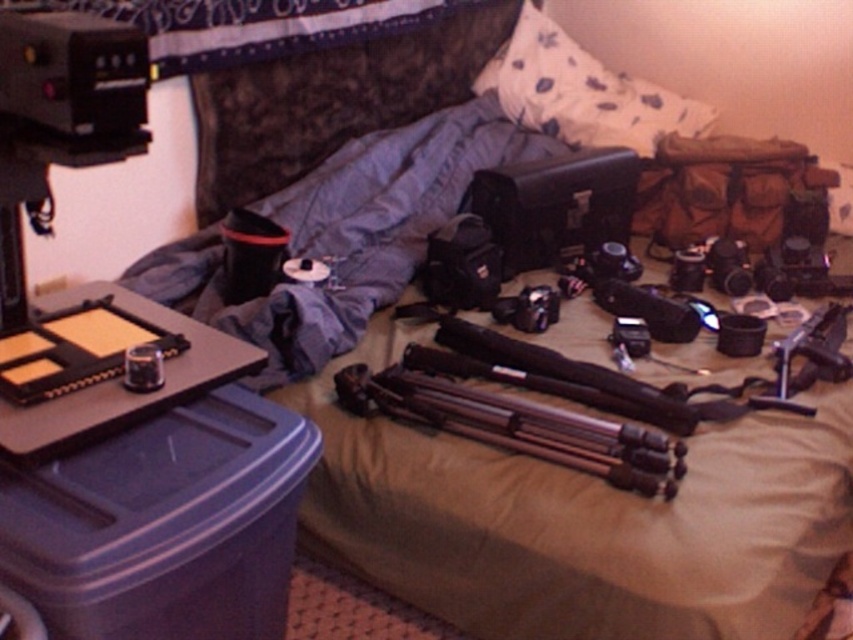
Question: Can you confirm if silver metallic tripod at center is smaller than white floral fabric pillow at upper center?

Choices:
 (A) no
 (B) yes

Answer: (B)

Question: Can you confirm if silver metallic tripod at center is positioned above white floral fabric pillow at upper center?

Choices:
 (A) yes
 (B) no

Answer: (B)

Question: Which point appears closest to the camera in this image?

Choices:
 (A) (596, 88)
 (B) (604, 451)

Answer: (B)

Question: Which of the following is the closest to the observer?

Choices:
 (A) silver metallic tripod at center
 (B) white floral fabric pillow at upper center

Answer: (A)

Question: Is silver metallic tripod at center bigger than white floral fabric pillow at upper center?

Choices:
 (A) no
 (B) yes

Answer: (A)